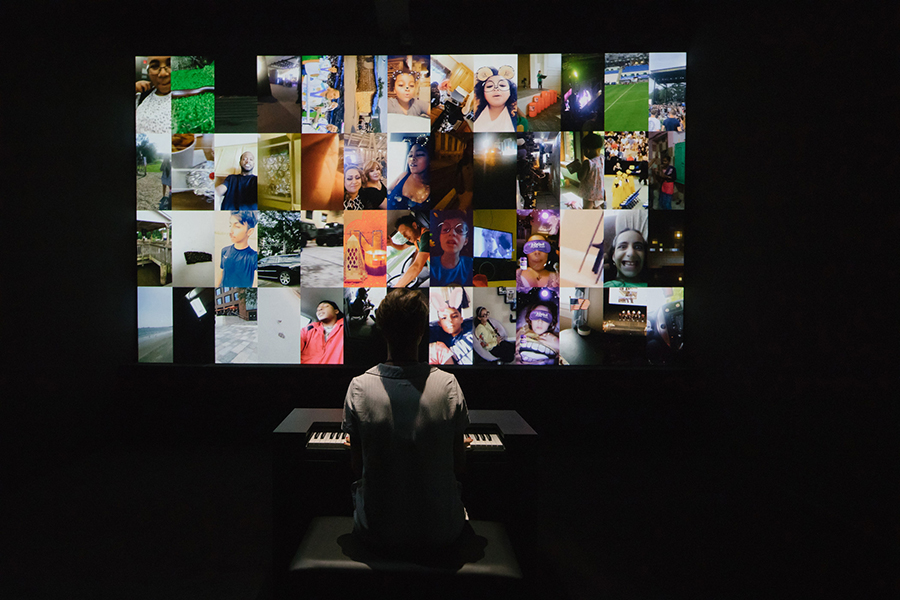
Where is `keyboard`? The width and height of the screenshot is (900, 600). keyboard is located at coordinates (483, 438).